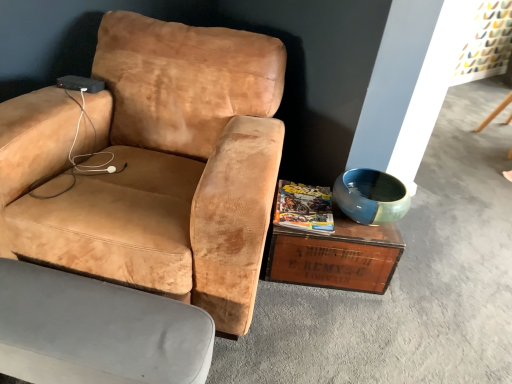
Question: Is the depth of suede tan chair at center, the second chair from the bottom, greater than that of matte yellow magazine at center?

Choices:
 (A) yes
 (B) no

Answer: (B)

Question: Can you confirm if suede tan chair at center, the second chair from the bottom, is smaller than matte yellow magazine at center?

Choices:
 (A) no
 (B) yes

Answer: (A)

Question: From the image's perspective, is suede tan chair at center, the 1th chair from the top, on top of matte yellow magazine at center?

Choices:
 (A) no
 (B) yes

Answer: (B)

Question: Is suede tan chair at center, the 1th chair from the top, in front of matte yellow magazine at center?

Choices:
 (A) no
 (B) yes

Answer: (B)

Question: Is suede tan chair at center, the second chair from the bottom, outside matte yellow magazine at center?

Choices:
 (A) no
 (B) yes

Answer: (B)

Question: From a real-world perspective, is suede tan chair at center, the 1th chair from the top, physically above matte yellow magazine at center?

Choices:
 (A) yes
 (B) no

Answer: (A)

Question: Can you confirm if wooden crate at lower right is positioned to the right of velvet beige armchair at lower left, the 1th chair in the bottom-to-top sequence?

Choices:
 (A) yes
 (B) no

Answer: (A)

Question: From a real-world perspective, is wooden crate at lower right located higher than velvet beige armchair at lower left, the 1th chair in the bottom-to-top sequence?

Choices:
 (A) no
 (B) yes

Answer: (B)

Question: Can you confirm if wooden crate at lower right is shorter than velvet beige armchair at lower left, the 2th chair when ordered from top to bottom?

Choices:
 (A) yes
 (B) no

Answer: (B)

Question: Does wooden crate at lower right have a greater width compared to velvet beige armchair at lower left, the 1th chair in the bottom-to-top sequence?

Choices:
 (A) no
 (B) yes

Answer: (B)

Question: Does wooden crate at lower right have a greater height compared to velvet beige armchair at lower left, the 1th chair in the bottom-to-top sequence?

Choices:
 (A) yes
 (B) no

Answer: (A)

Question: From a real-world perspective, is wooden crate at lower right beneath velvet beige armchair at lower left, the 2th chair when ordered from top to bottom?

Choices:
 (A) yes
 (B) no

Answer: (B)

Question: From a real-world perspective, is velvet beige armchair at lower left, the 1th chair in the bottom-to-top sequence, located higher than matte yellow magazine at center?

Choices:
 (A) no
 (B) yes

Answer: (A)